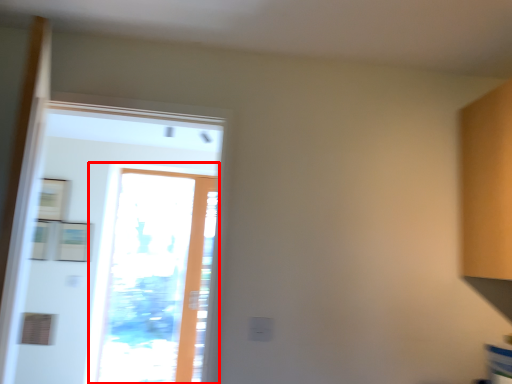
Question: Considering the relative positions of window (annotated by the red box) and screen door in the image provided, where is window (annotated by the red box) located with respect to the staircase?

Choices:
 (A) left
 (B) right

Answer: (A)